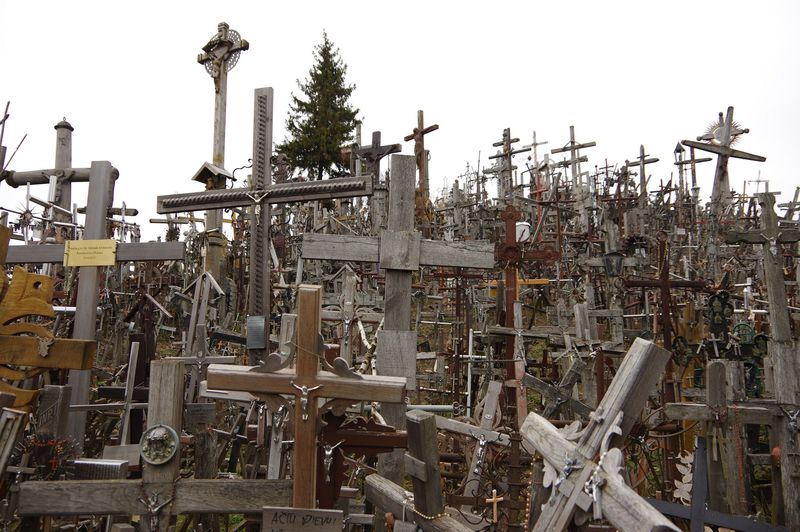
Where is `brass plaque`? brass plaque is located at coordinates (102, 257).